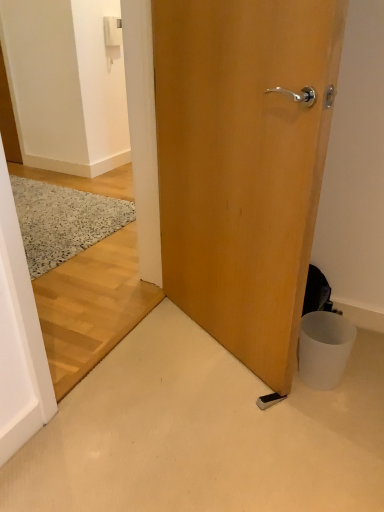
Question: Is white matte trash bin at lower right in front of or behind white plastic light switch at upper center in the image?

Choices:
 (A) behind
 (B) front

Answer: (B)

Question: Would you say white matte trash bin at lower right is inside or outside white plastic light switch at upper center?

Choices:
 (A) inside
 (B) outside

Answer: (B)

Question: Which object is the closest to the wooden door at center?

Choices:
 (A) white plastic light switch at upper center
 (B) speckled wool doormat at left
 (C) white matte trash bin at lower right

Answer: (C)

Question: Which of these objects is positioned farthest from the wooden door at center?

Choices:
 (A) speckled wool doormat at left
 (B) white plastic light switch at upper center
 (C) white matte trash bin at lower right

Answer: (B)